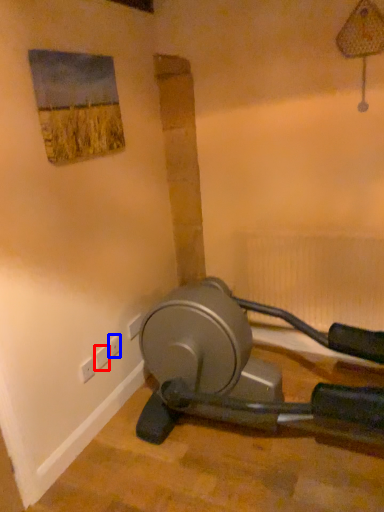
Question: Which object is further to the camera taking this photo, plug (highlighted by a red box) or electric outlet (highlighted by a blue box)?

Choices:
 (A) plug
 (B) electric outlet

Answer: (B)